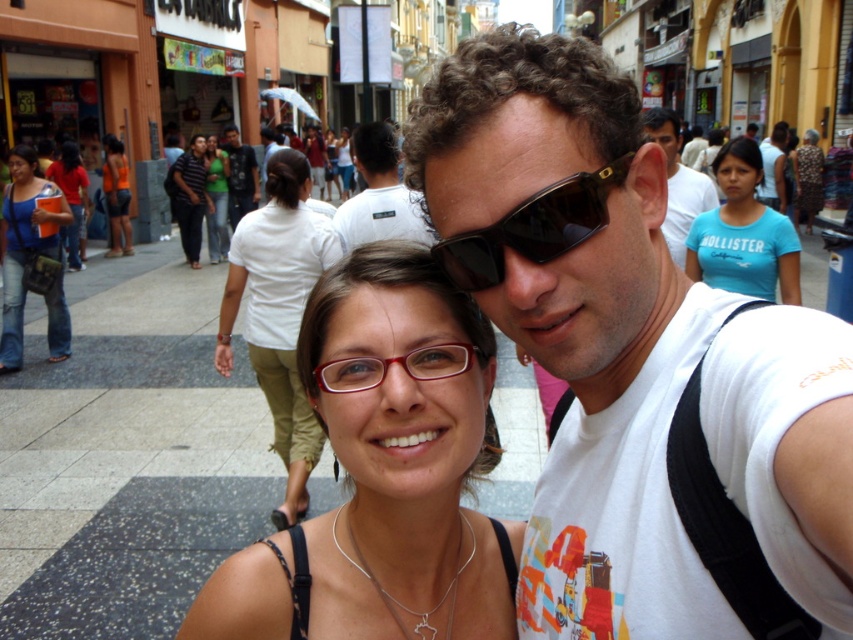
Question: Which point is farther from the camera taking this photo?

Choices:
 (A) (131, 241)
 (B) (199, 214)
 (C) (502, 257)
 (D) (780, 205)

Answer: (A)

Question: Is matte white t-shirt at center positioned before matte blue shirt at left?

Choices:
 (A) yes
 (B) no

Answer: (A)

Question: Which of the following is the farthest from the observer?

Choices:
 (A) dark blue striped shirt at center
 (B) white matte t-shirt at center
 (C) red matte glasses at center

Answer: (A)

Question: Considering the relative positions of matte white t-shirt at center and matte red glasses at center in the image provided, where is matte white t-shirt at center located with respect to matte red glasses at center?

Choices:
 (A) left
 (B) right

Answer: (B)

Question: Can you confirm if orange fabric shorts at center is positioned to the right of matte white shirt at center?

Choices:
 (A) no
 (B) yes

Answer: (A)

Question: Considering the real-world distances, which object is closest to the white t-shirt at center?

Choices:
 (A) red matte glasses at center
 (B) printed fabric dress at center
 (C) orange fabric shorts at center
 (D) matte blue t-shirt at upper right

Answer: (A)